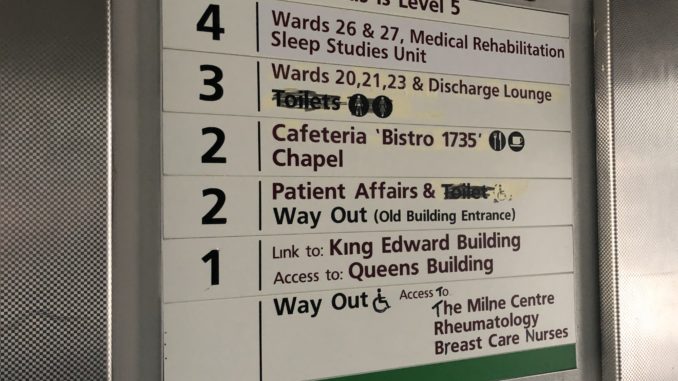
Locate an element on the screen. white sign on the wall is located at coordinates (363, 349).